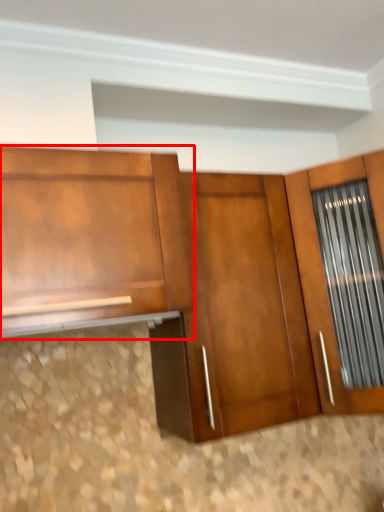
Question: From the image's perspective, where is cabinetry (annotated by the red box) located relative to door?

Choices:
 (A) below
 (B) above

Answer: (B)